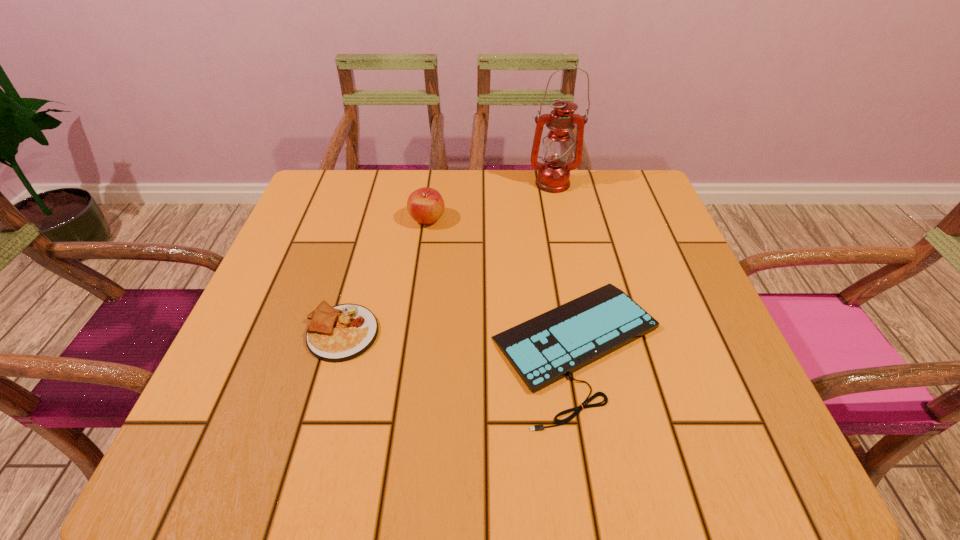
This screenshot has height=540, width=960. In order to click on the farthest object in this screenshot , I will do `click(553, 176)`.

Find the location of a particular element. The image size is (960, 540). the tallest object is located at coordinates (553, 176).

Image resolution: width=960 pixels, height=540 pixels. Identify the location of apple. (425, 205).

This screenshot has width=960, height=540. I want to click on the second object from left to right, so click(425, 205).

The height and width of the screenshot is (540, 960). What are the coordinates of `the third tallest object` in the screenshot? It's located at (339, 333).

At what (x,y) coordinates should I click in order to perform the action: click on the leftmost object. Please return your answer as a coordinate pair (x, y). Looking at the image, I should click on (339, 333).

The width and height of the screenshot is (960, 540). Find the location of `the shortest object`. the shortest object is located at coordinates (546, 348).

Identify the location of vacant space located on the right of the tallest object. (636, 184).

What are the coordinates of `free space located on the front of the third shortest object` in the screenshot? It's located at (414, 316).

Locate an element on the screen. The height and width of the screenshot is (540, 960). free spot located on the back of the leftmost object is located at coordinates (359, 272).